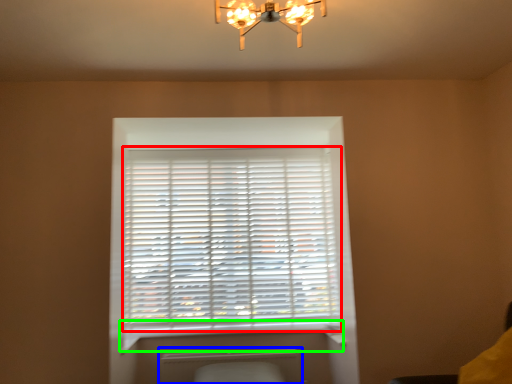
Question: Which is nearer to the window blind (highlighted by a red box)? radiator (highlighted by a blue box) or window sill (highlighted by a green box).

Choices:
 (A) radiator
 (B) window sill

Answer: (B)